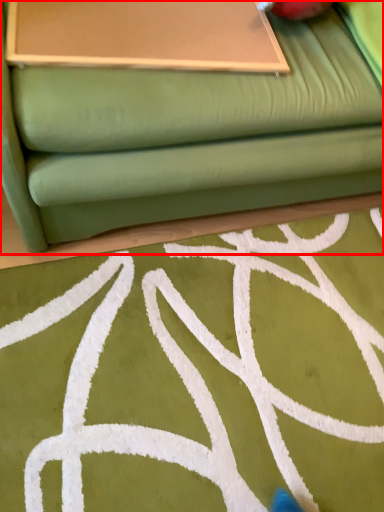
Question: From the image's perspective, where is studio couch (annotated by the red box) located relative to table?

Choices:
 (A) below
 (B) above

Answer: (B)